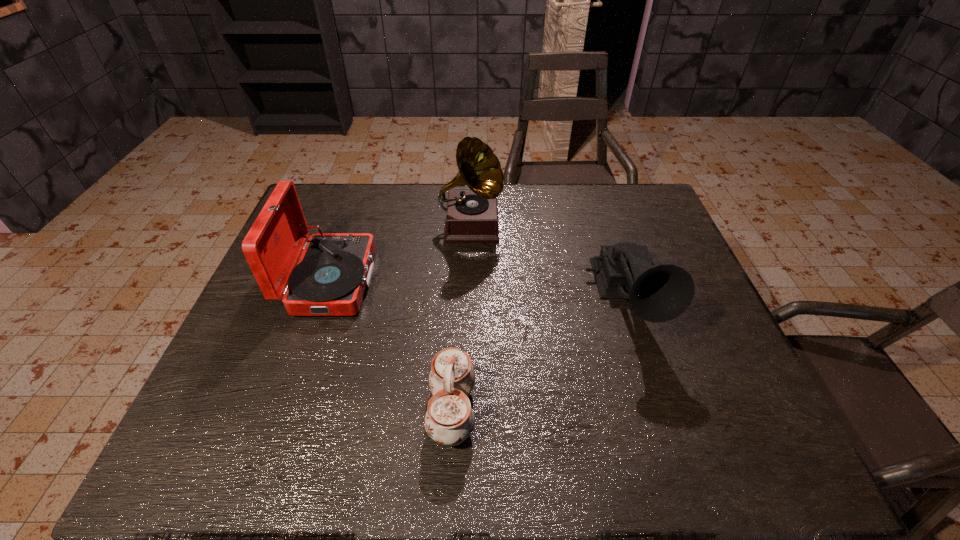
Find the location of a particular element. the tallest object is located at coordinates (471, 216).

The image size is (960, 540). Identify the location of the tallest phonograph_record. (471, 216).

Where is `the leftmost phonograph_record`? The width and height of the screenshot is (960, 540). the leftmost phonograph_record is located at coordinates (334, 269).

Locate an element on the screen. The image size is (960, 540). the rightmost phonograph_record is located at coordinates (660, 293).

You are a GUI agent. You are given a task and a screenshot of the screen. Output one action in this format:
    pyautogui.click(x=<x>, y=<y>)
    Task: Click on the shortest object
    The image size is (960, 540).
    Given the screenshot: What is the action you would take?
    pyautogui.click(x=449, y=420)

Locate an element on the screen. This screenshot has height=540, width=960. chinaware is located at coordinates (449, 420).

The height and width of the screenshot is (540, 960). Identify the location of vacant region located from the horn of the tallest object. (468, 339).

Find the location of a particular element. free space located on the front-facing side of the leftmost phonograph_record is located at coordinates (476, 281).

Where is `free space located 0.220m from the horn of the rightmost phonograph_record`? The height and width of the screenshot is (540, 960). free space located 0.220m from the horn of the rightmost phonograph_record is located at coordinates (673, 448).

Identify the location of vacant space located 0.240m by the handle of the chinaware. (591, 410).